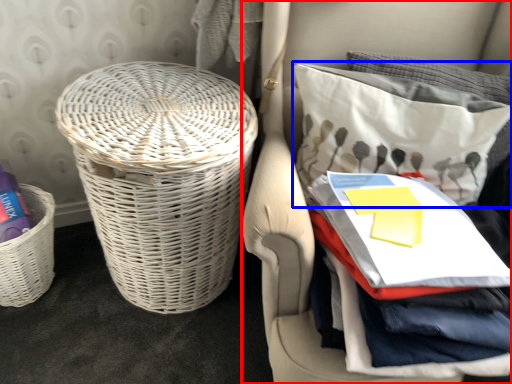
Question: Which object appears closest to the camera in this image, furniture (highlighted by a red box) or pillow (highlighted by a blue box)?

Choices:
 (A) furniture
 (B) pillow

Answer: (A)